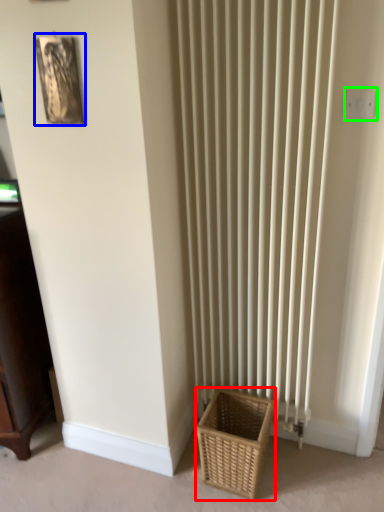
Question: Considering the real-world distances, which object is farthest from basket (highlighted by a red box)? picture frame (highlighted by a blue box) or electric outlet (highlighted by a green box)?

Choices:
 (A) picture frame
 (B) electric outlet

Answer: (A)